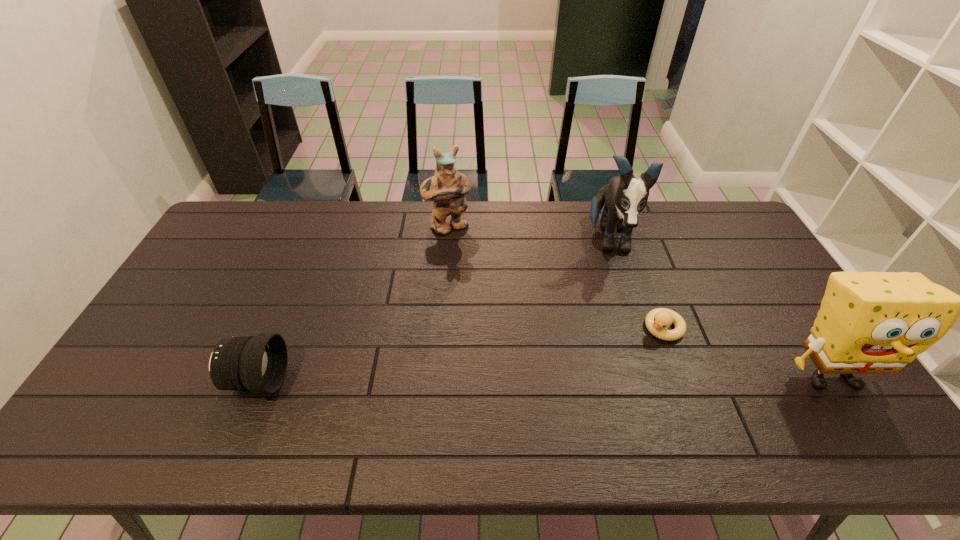
Where is `free spot on the desktop that is between the telephoto lens and the rightmost object and is positioned at the beak of the shortest object`? Image resolution: width=960 pixels, height=540 pixels. free spot on the desktop that is between the telephoto lens and the rightmost object and is positioned at the beak of the shortest object is located at coordinates (605, 378).

The image size is (960, 540). Identify the location of vacant space on the desktop that is between the leftmost object and the sponge and is positioned on the front-facing side of the second object from left to right. (545, 379).

What are the coordinates of `vacant space on the desktop that is between the fourth tallest object and the rightmost object and is positioned on the front-facing side of the tallest object` in the screenshot? It's located at (621, 378).